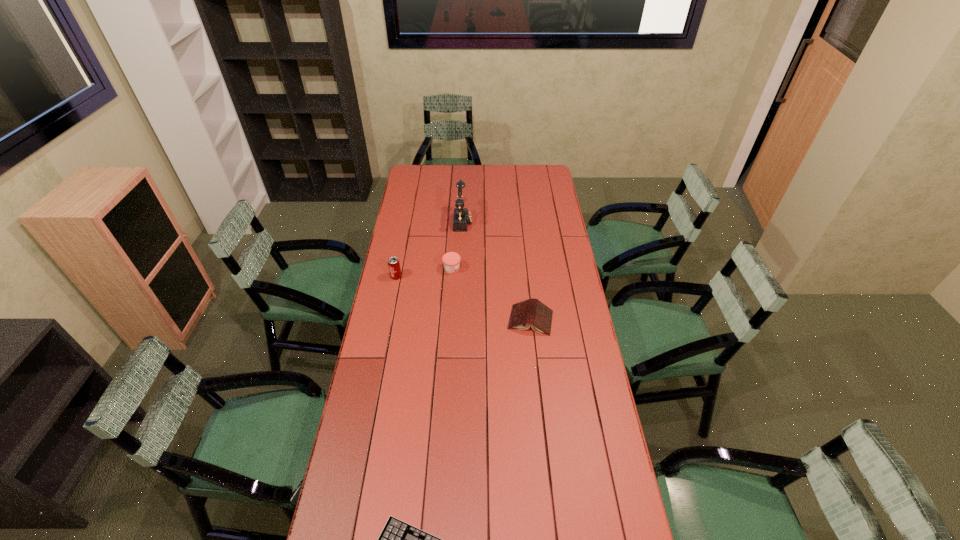
The height and width of the screenshot is (540, 960). In order to click on vacant area between the farthest object and the rightmost object in this screenshot , I will do `click(496, 271)`.

You are a GUI agent. You are given a task and a screenshot of the screen. Output one action in this format:
    pyautogui.click(x=<x>, y=<y>)
    Task: Click on the free space between the second shortest object and the farthest object
    
    Given the screenshot: What is the action you would take?
    [x=496, y=271]

Image resolution: width=960 pixels, height=540 pixels. Find the location of `free spot between the jam and the beer can`. free spot between the jam and the beer can is located at coordinates pyautogui.click(x=424, y=273).

In order to click on the closest object relative to the nearest object in this screenshot , I will do pos(533,312).

The height and width of the screenshot is (540, 960). In order to click on object that is the third closest to the farthest object in this screenshot , I will do `click(533, 312)`.

Identify the location of blank area in the image that satisfies the following two spatial constraints: 1. on the dial of the fourth farthest object; 2. on the right side of the telephone. The width and height of the screenshot is (960, 540). (458, 320).

The height and width of the screenshot is (540, 960). In order to click on vacant space that satisfies the following two spatial constraints: 1. on the front label of the rightmost object; 2. on the right side of the jam in this screenshot , I will do `click(448, 320)`.

This screenshot has height=540, width=960. I want to click on free region that satisfies the following two spatial constraints: 1. on the dial of the tallest object; 2. on the back side of the second nearest object, so click(x=458, y=320).